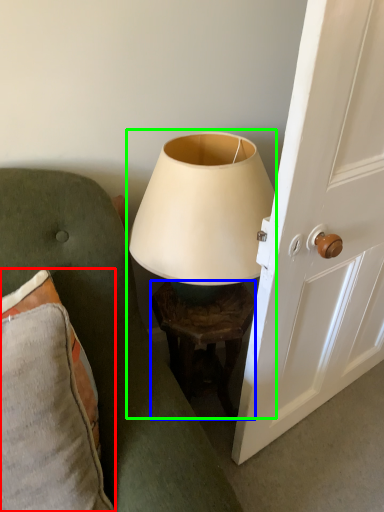
Question: Which is farther away from pillow (highlighted by a red box)? table (highlighted by a blue box) or lamp (highlighted by a green box)?

Choices:
 (A) table
 (B) lamp

Answer: (A)